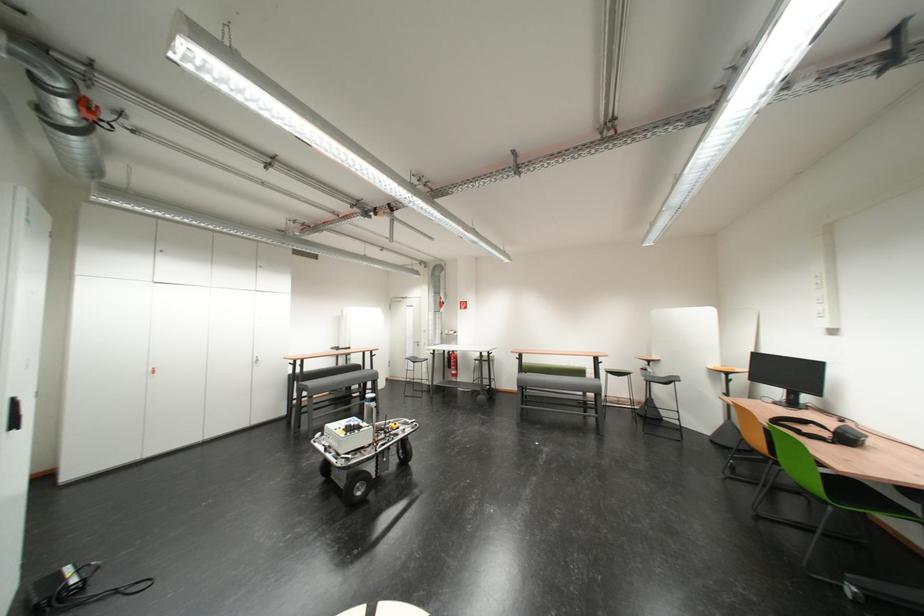
What do you see at coordinates (418, 346) in the screenshot?
I see `the white door handle` at bounding box center [418, 346].